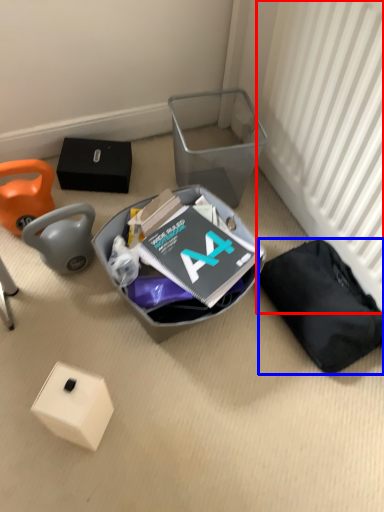
Question: Which object appears farthest to the camera in this image, radiator (highlighted by a red box) or waste (highlighted by a blue box)?

Choices:
 (A) radiator
 (B) waste

Answer: (B)